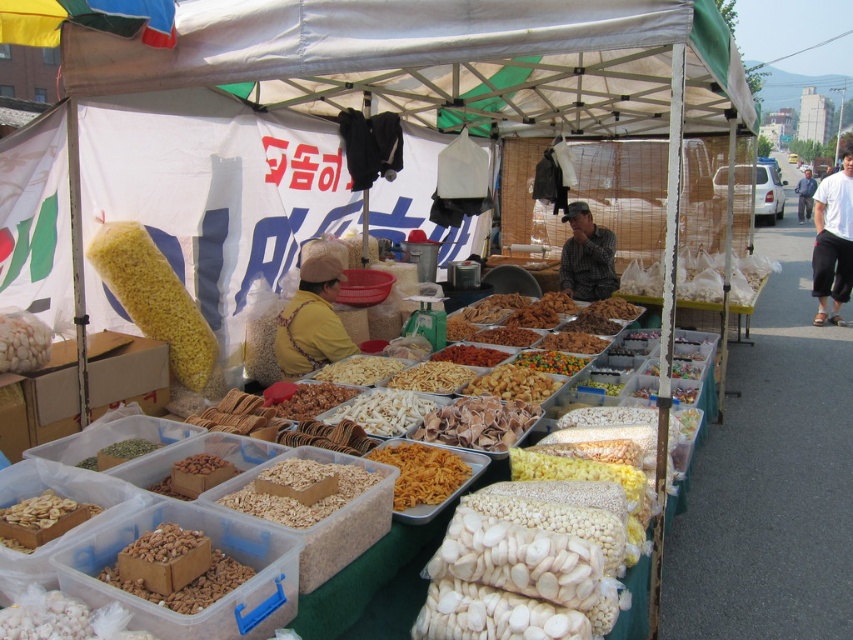
Which is behind, point (387, 458) or point (799, 189)?

The point (799, 189) is behind.

Who is positioned more to the left, yellowish-brown crispy snack at center or white cotton shirt at center?

yellowish-brown crispy snack at center is more to the left.

Image resolution: width=853 pixels, height=640 pixels. I want to click on yellowish-brown crispy snack at center, so coord(421,472).

Can you confirm if peeled beige nuts at lower left is positioned to the left of white matte dried noodles at center?

Indeed, peeled beige nuts at lower left is positioned on the left side of white matte dried noodles at center.

Can you confirm if peeled beige nuts at lower left is bigger than white matte dried noodles at center?

No, peeled beige nuts at lower left is not bigger than white matte dried noodles at center.

Between point (49, 540) and point (410, 368), which one is positioned in front?

Point (49, 540) is in front.

Find the location of a particular element. The image size is (853, 640). peeled beige nuts at lower left is located at coordinates (41, 518).

Between point (645, 100) and point (811, 289), which one is positioned behind?

The point (811, 289) is behind.

What do you see at coordinates (440, 61) in the screenshot? The image size is (853, 640). I see `white fabric canopy at upper center` at bounding box center [440, 61].

Consider the image. Measure the distance between white fabric canopy at upper center and camera.

white fabric canopy at upper center is 18.40 feet away from camera.

Identify the location of white fabric canopy at upper center. This screenshot has width=853, height=640. (440, 61).